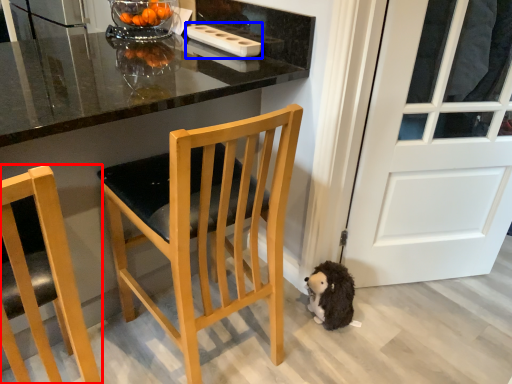
Question: Among these objects, which one is farthest to the camera, chair (highlighted by a red box) or appliance (highlighted by a blue box)?

Choices:
 (A) chair
 (B) appliance

Answer: (B)